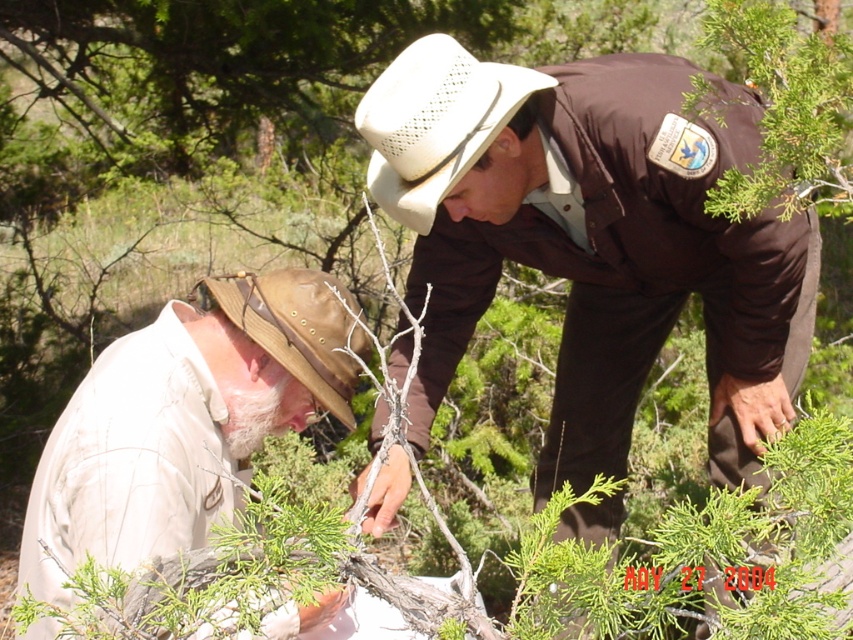
Does white cotton shirt at lower left have a lesser height compared to brown leather hat at lower left?

No.

Based on the photo, between white cotton shirt at lower left and brown leather hat at lower left, which one is positioned higher?

brown leather hat at lower left is above.

Which is in front, point (114, 524) or point (340, 298)?

Point (340, 298)

Where is `white cotton shirt at lower left`? The width and height of the screenshot is (853, 640). white cotton shirt at lower left is located at coordinates (184, 420).

Consider the image. Is white cotton shirt at lower left above white woven hat at center?

Incorrect, white cotton shirt at lower left is not positioned above white woven hat at center.

Which of these two, white cotton shirt at lower left or white woven hat at center, stands taller?

Standing taller between the two is white cotton shirt at lower left.

Is point (213, 433) behind point (483, 144)?

No, it is not.

Find the location of a particular element. white cotton shirt at lower left is located at coordinates (184, 420).

Is brown uniform at center in front of white woven hat at center?

Yes, brown uniform at center is in front of white woven hat at center.

Which of these two, brown uniform at center or white woven hat at center, stands taller?

Standing taller between the two is brown uniform at center.

What are the coordinates of `brown uniform at center` in the screenshot? It's located at (592, 241).

Find the location of `brown uniform at center`. brown uniform at center is located at coordinates 592,241.